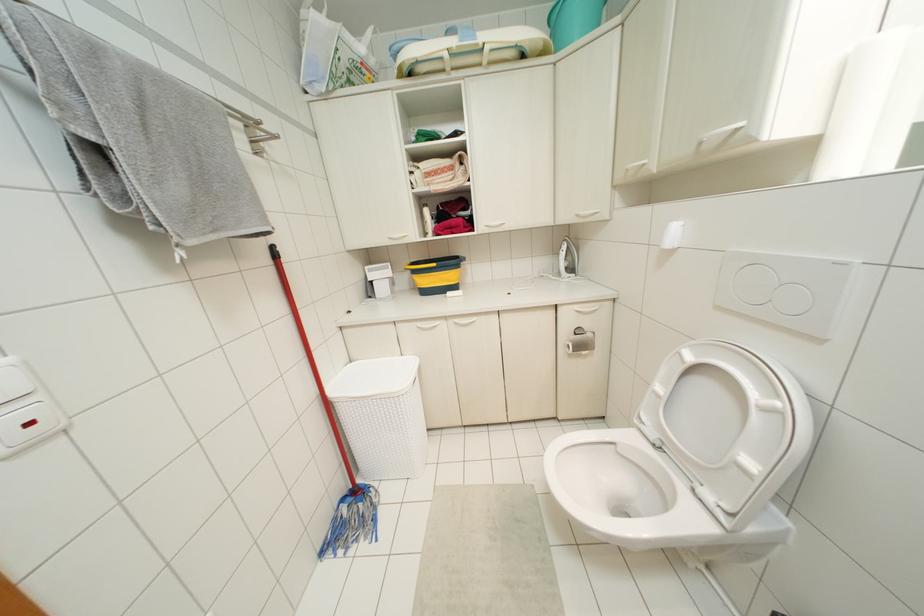
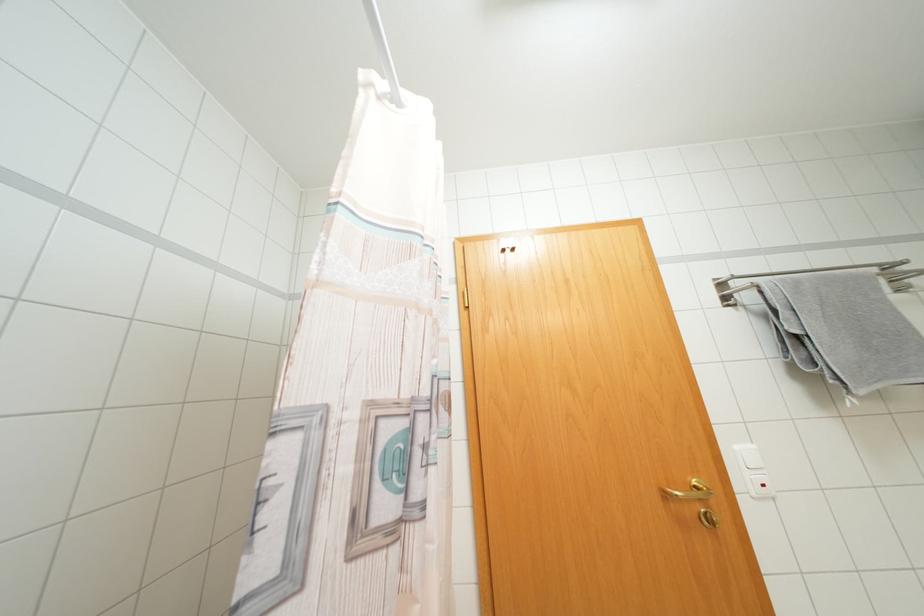
Where in the second image is the point corresponding to pixel 213 236 from the first image?

(877, 386)